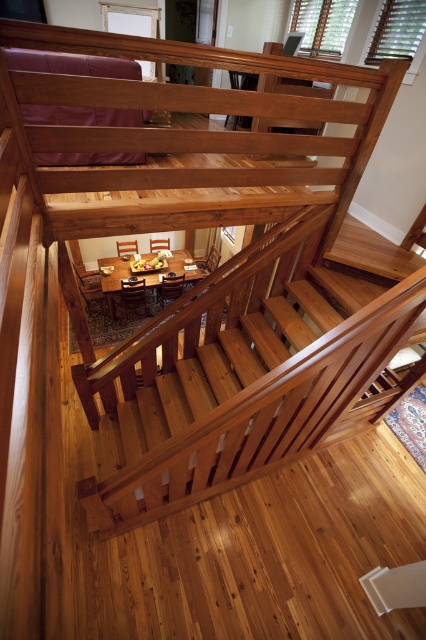
You are a delivery person with a package that is 12 feet long. You need to place it in the living area without it extending beyond the space between the natural wood stairs at center and the brown wooden dining table at center. Is this possible?

The distance between the natural wood stairs at center and the brown wooden dining table at center is 13.03 feet. Since the package is 12 feet long, it can fit within the space as it is shorter than the available distance.

You are a painter who needs to hang a picture frame on the wall behind the natural wood stairs at center and the brown wooden dining table at center. Which object would you need to position the frame higher to avoid it being blocked by the other?

The natural wood stairs at center is taller than the brown wooden dining table at center, so you should position the frame higher to avoid being blocked by the natural wood stairs at center.

You are standing at the top of the natural wood stairs at center and want to walk down to the brown wooden dining table at center. In which direction should you move relative to the dining table to reach it?

To reach the brown wooden dining table at center from the natural wood stairs at center, you should move to the left since the stairs are positioned to the right of the dining table.